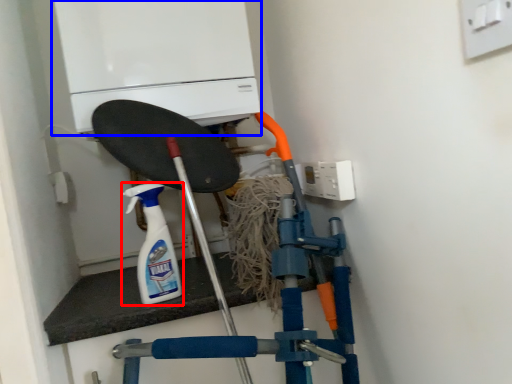
Question: Among these objects, which one is nearest to the camera, cleaning product (highlighted by a red box) or home appliance (highlighted by a blue box)?

Choices:
 (A) cleaning product
 (B) home appliance

Answer: (A)